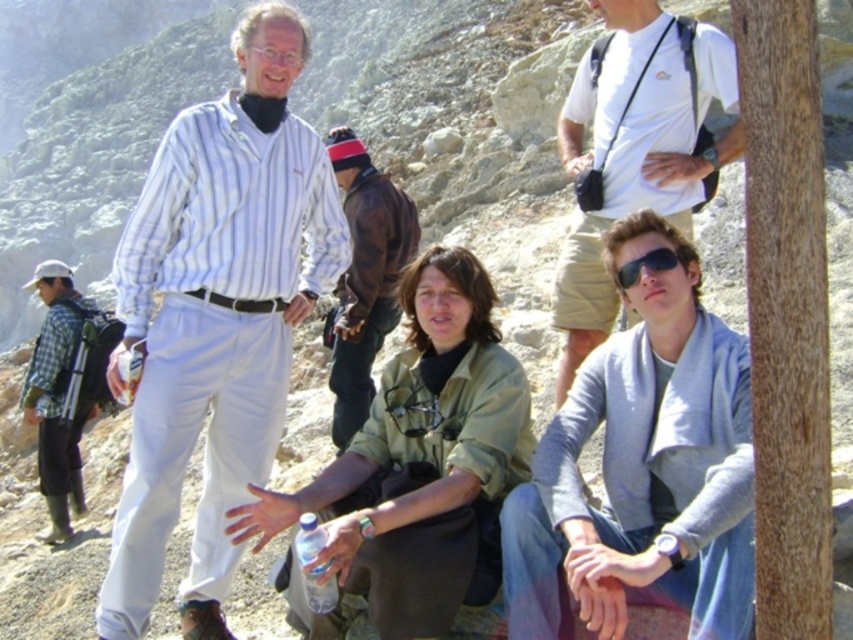
Question: Which object is the farthest from the leather jacket at center?

Choices:
 (A) sunglasses at center
 (B) white cotton t-shirt at upper center
 (C) green plaid shirt at left
 (D) white striped shirt at center

Answer: (A)

Question: Does white striped shirt at center have a larger size compared to green matte jacket at center?

Choices:
 (A) yes
 (B) no

Answer: (A)

Question: Which object is closer to the camera taking this photo?

Choices:
 (A) gray woolen sweater at center
 (B) green plaid shirt at left
 (C) green matte jacket at center

Answer: (A)

Question: In this image, where is white cotton t-shirt at upper center located relative to sunglasses at center?

Choices:
 (A) left
 (B) right

Answer: (B)

Question: Considering the relative positions of white striped shirt at center and gray woolen sweater at center in the image provided, where is white striped shirt at center located with respect to gray woolen sweater at center?

Choices:
 (A) above
 (B) below

Answer: (A)

Question: Which point is closer to the camera taking this photo?

Choices:
 (A) (352, 349)
 (B) (622, 273)
 (C) (386, 413)
 (D) (720, 330)

Answer: (D)